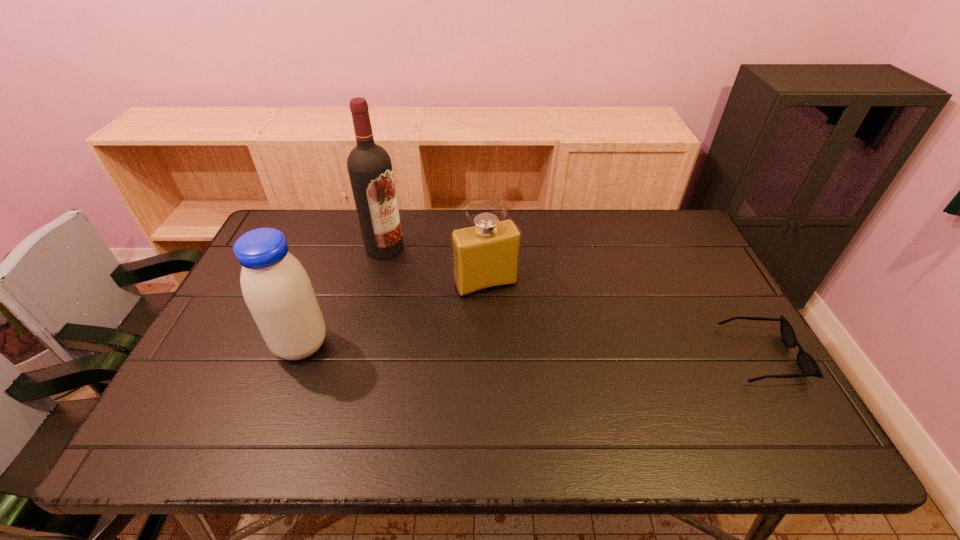
Find the location of a particular element. vacant space situated on the front-facing side of the perfume is located at coordinates (531, 367).

At what (x,y) coordinates should I click in order to perform the action: click on vacant area located 0.230m on the front-facing side of the perfume. Please return your answer as a coordinate pair (x, y). The height and width of the screenshot is (540, 960). Looking at the image, I should click on (527, 361).

Identify the location of vacant space positioned on the label of the second object from left to right. This screenshot has width=960, height=540. (405, 269).

At what (x,y) coordinates should I click in order to perform the action: click on vacant space located 0.150m on the label of the second object from left to right. Please return your answer as a coordinate pair (x, y). The height and width of the screenshot is (540, 960). Looking at the image, I should click on (418, 284).

Image resolution: width=960 pixels, height=540 pixels. Find the location of `vacant space located 0.180m on the label of the second object from left to right`. vacant space located 0.180m on the label of the second object from left to right is located at coordinates (423, 289).

Find the location of a particular element. The image size is (960, 540). object located at the far edge is located at coordinates (369, 166).

Find the location of `object positioned at the near edge`. object positioned at the near edge is located at coordinates pos(806,362).

Identify the location of object that is at the right edge. The width and height of the screenshot is (960, 540). (806, 362).

Where is `object that is at the near right corner`? This screenshot has width=960, height=540. object that is at the near right corner is located at coordinates (x=806, y=362).

Find the location of `vacant space at the far edge of the desktop`. vacant space at the far edge of the desktop is located at coordinates (564, 252).